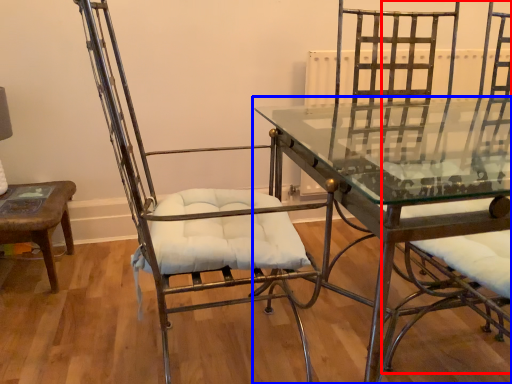
Question: Which of the following is the farthest to the observer, swivel chair (highlighted by a red box) or table (highlighted by a blue box)?

Choices:
 (A) swivel chair
 (B) table

Answer: (B)